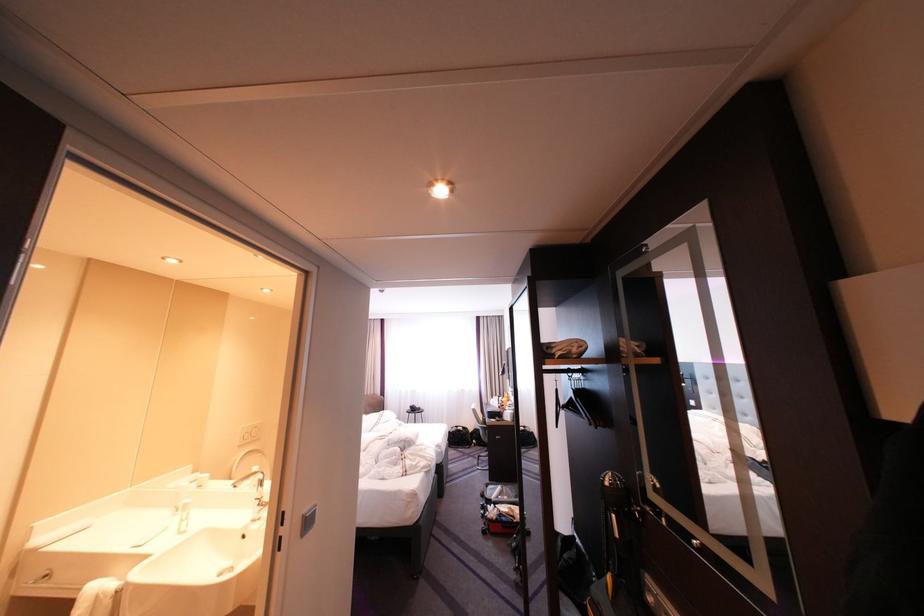
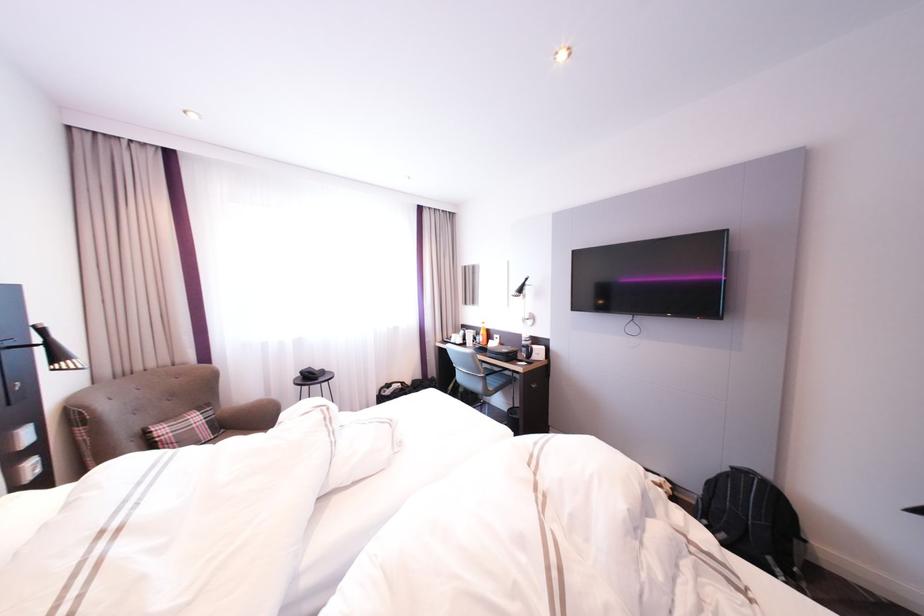
Locate, in the second image, the point that corresponds to (468,428) in the first image.

(400, 386)